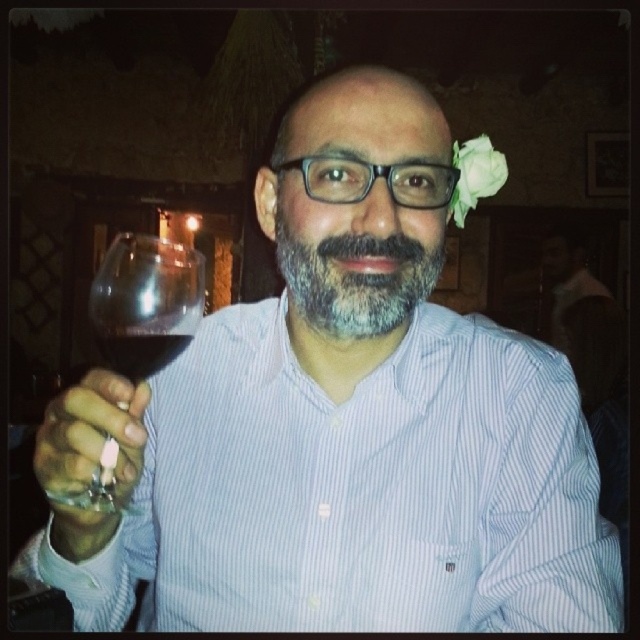
Question: Which point is closer to the camera?

Choices:
 (A) (474, 205)
 (B) (118, 368)

Answer: (B)

Question: In this image, where is gray matte beard at center located relative to matte glass wine glass at lower left?

Choices:
 (A) left
 (B) right

Answer: (B)

Question: Which object is the farthest from the transparent glass at upper left?

Choices:
 (A) white paper flower at upper right
 (B) matte glass wine glass at lower left

Answer: (A)

Question: Does transparent glass at upper left appear on the right side of white paper flower at upper right?

Choices:
 (A) yes
 (B) no

Answer: (B)

Question: Can you confirm if white paper flower at upper right is positioned to the left of dark red glass at center?

Choices:
 (A) no
 (B) yes

Answer: (A)

Question: Which object appears closest to the camera in this image?

Choices:
 (A) gray matte beard at center
 (B) transparent glass at upper left
 (C) matte glass wine glass at lower left

Answer: (C)